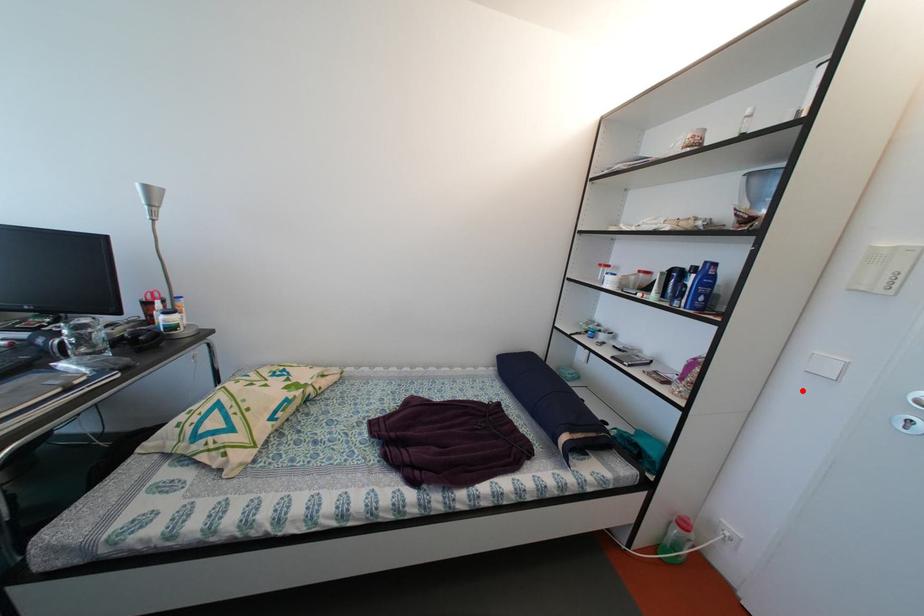
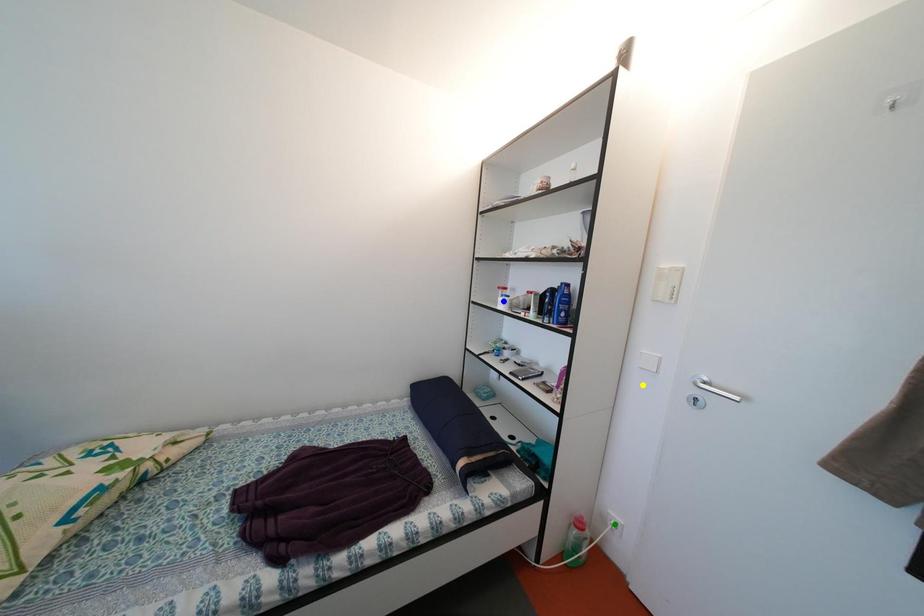
Question: I am providing you with two images of the same scene from different viewpoints. A red point is marked on the first image. You are given multiple points on the second image. Which spot in image 2 lines up with the point in image 1?

Choices:
 (A) blue point
 (B) green point
 (C) yellow point

Answer: (C)